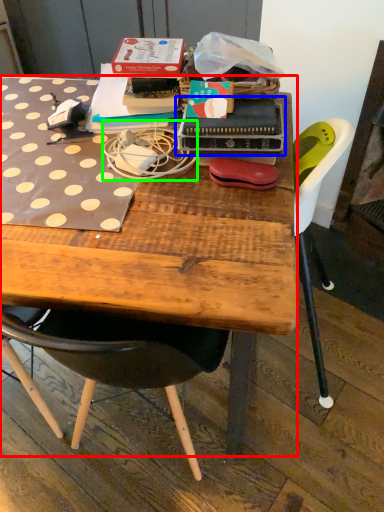
Question: Which object is the closest to the desk (highlighted by a red box)? Choose among these: paperback book (highlighted by a blue box) or string (highlighted by a green box).

Choices:
 (A) paperback book
 (B) string

Answer: (B)